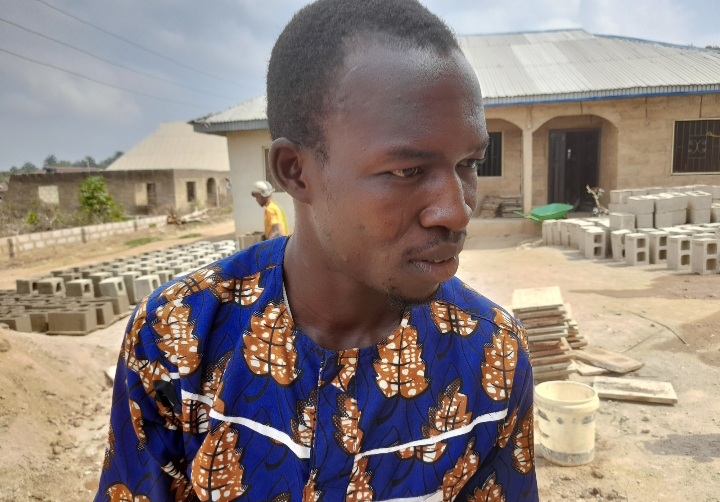
The width and height of the screenshot is (720, 502). What are the coordinates of `door` in the screenshot? It's located at (574, 168).